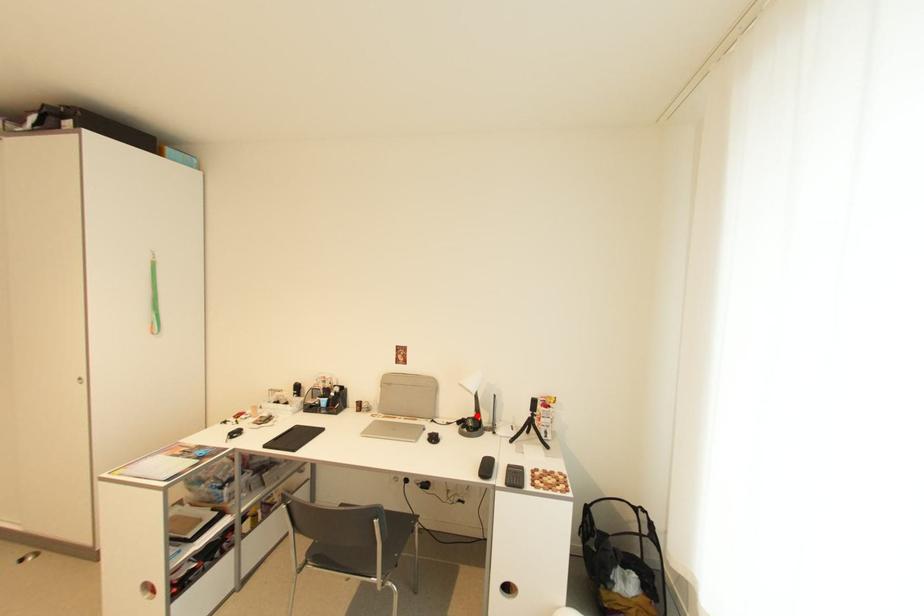
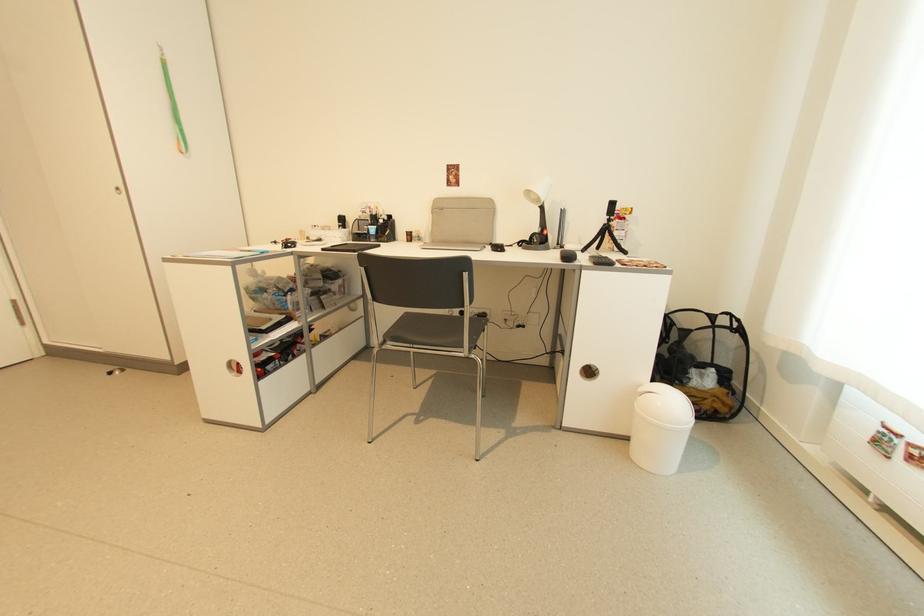
Question: I am providing you with two images of the same scene from different viewpoints. A red point is shown in image1. For the corresponding object point in image2, is it positioned nearer or farther from the camera?

Choices:
 (A) Nearer
 (B) Farther

Answer: (A)